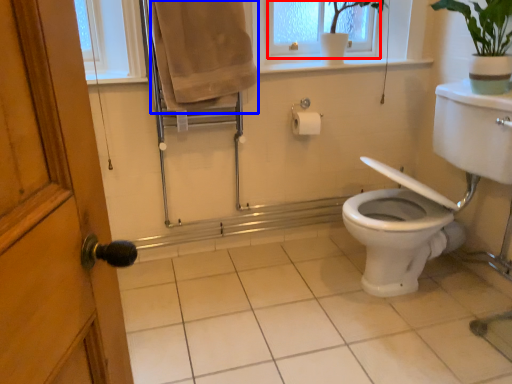
Question: Which object is closer to the camera taking this photo, window frame (highlighted by a red box) or bath towel (highlighted by a blue box)?

Choices:
 (A) window frame
 (B) bath towel

Answer: (B)